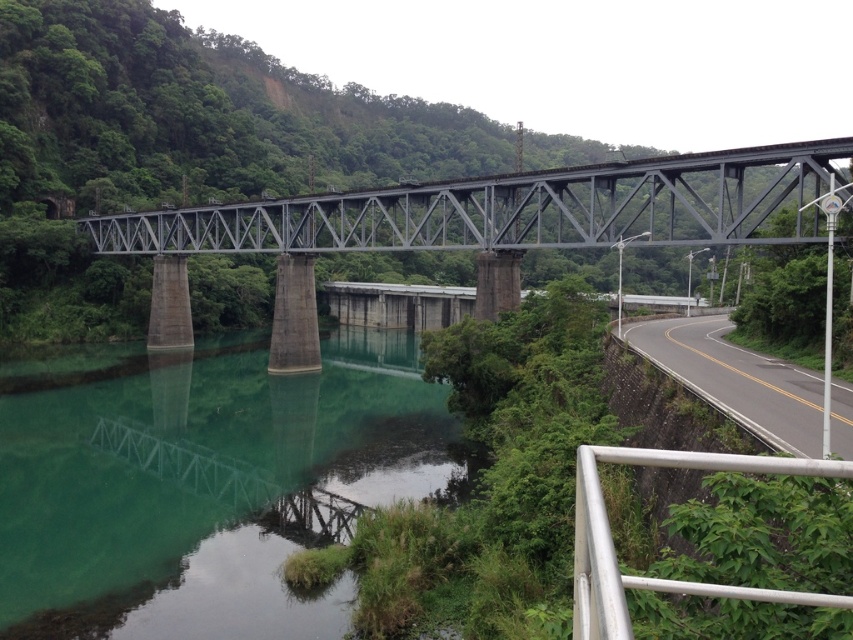
Question: Is green concrete river at center bigger than metal bridge at center?

Choices:
 (A) yes
 (B) no

Answer: (B)

Question: Which point is farther to the camera?

Choices:
 (A) silver metallic railing at lower right
 (B) green concrete river at center

Answer: (B)

Question: Is green concrete river at center bigger than silver metallic railing at lower right?

Choices:
 (A) yes
 (B) no

Answer: (A)

Question: Which point is closer to the camera?

Choices:
 (A) metal bridge at center
 (B) green concrete river at center

Answer: (B)

Question: Can you confirm if green concrete river at center is smaller than silver metallic railing at lower right?

Choices:
 (A) no
 (B) yes

Answer: (A)

Question: Which object is the closest to the black asphalt road at lower right?

Choices:
 (A) green concrete river at center
 (B) metal bridge at center

Answer: (B)